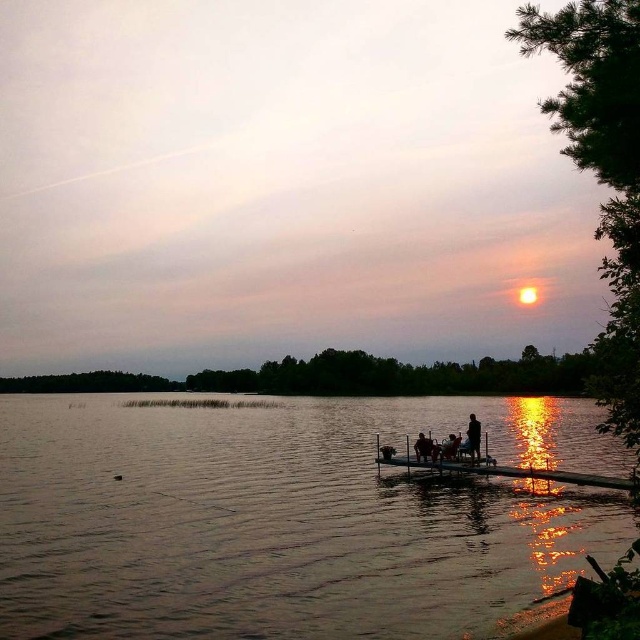
Can you confirm if silhouette figure at center is bigger than smooth skin person at center?

Correct, silhouette figure at center is larger in size than smooth skin person at center.

Is point (476, 435) farther from camera compared to point (445, 456)?

No.

Does point (468, 436) come behind point (454, 442)?

No, (468, 436) is in front of (454, 442).

Image resolution: width=640 pixels, height=640 pixels. I want to click on silhouette figure at center, so click(474, 436).

Does dark blue fabric jacket at center have a greater height compared to smooth skin person at center?

Incorrect, dark blue fabric jacket at center's height is not larger of smooth skin person at center's.

Where is `dark blue fabric jacket at center`? The width and height of the screenshot is (640, 640). dark blue fabric jacket at center is located at coordinates (422, 448).

Locate an element on the screen. This screenshot has height=640, width=640. dark blue fabric jacket at center is located at coordinates (422, 448).

Does dull metallic water at center appear over silhouette figure at center?

Incorrect, dull metallic water at center is not positioned above silhouette figure at center.

Who is shorter, dull metallic water at center or silhouette figure at center?

silhouette figure at center is shorter.

Between point (316, 481) and point (470, 449), which one is positioned behind?

Positioned behind is point (316, 481).

This screenshot has height=640, width=640. Identify the location of dull metallic water at center. (285, 518).